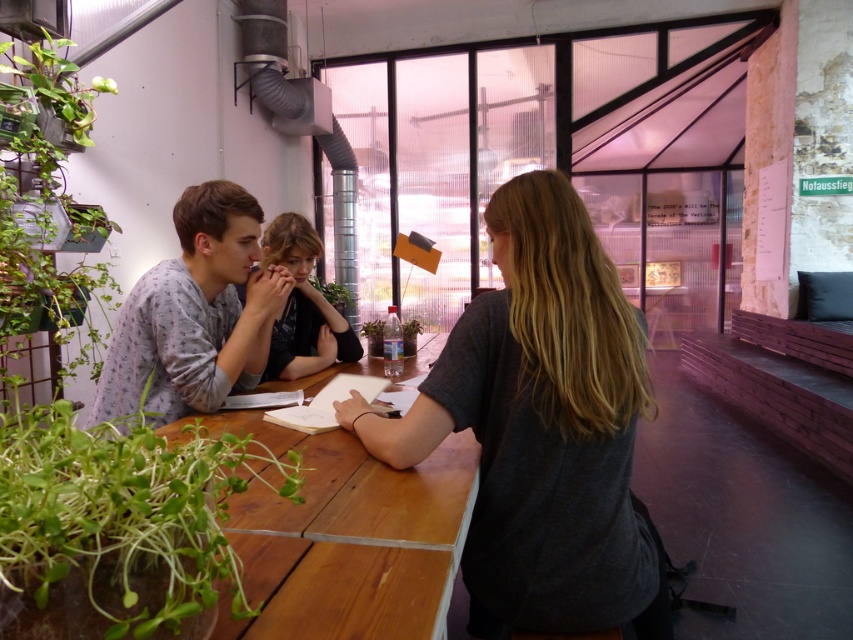
You are a person sitting at the table and want to place a small item on the surface between the light gray pajama top at center and the green leafy plant at left. Based on their positions, where would you place it so it is between them?

You should place the item below the green leafy plant at left and above the light gray pajama top at center since the light gray pajama top at center is below the green leafy plant at left.

You are a photographer trying to capture a candid shot of the light gray pajama top at center and the green leafy plant at left. To ensure both subjects are in focus, you need to know their heights. Which one is taller?

The green leafy plant at left is taller than the light gray pajama top at center.